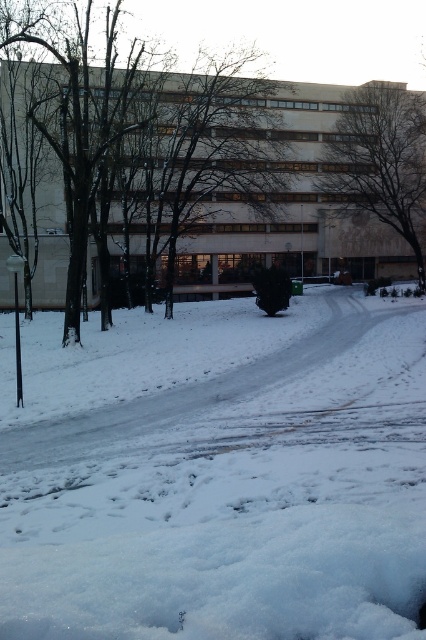
You are standing at the viewpoint in the snowy scene. There is a point marked at coordinates point (x=106, y=74). Can you walk straight towards that point without any obstacles? Please explain your reasoning based on the scene description.

The point (x=106, y=74) is 38.11 meters away from the viewer. The scene description mentions tire tracks and footprints on the snow in the foreground, but there is no mention of obstacles between the viewer and the point. Therefore, it is likely possible to walk straight towards the point without encountering obstacles, assuming the snow is passable and there are no unseen barriers.

You are standing at the point with coordinates point (31, 28) and want to walk to the point with coordinates point (127, 508). Which direction should you face to walk towards your destination?

You should face towards the direction of point (127, 508), which is in front of point (31, 28) according to the spatial relationship provided.

You are a delivery person trying to navigate through the snowy area. The white fluffy snow at center and the brown textured tree at upper center are in your path. Which one do you need to walk around to avoid getting your shoes wet?

You need to walk around the white fluffy snow at center to avoid getting your shoes wet since it is wider than the brown textured tree at upper center and might be deeper or softer, making it more likely to soak your shoes.